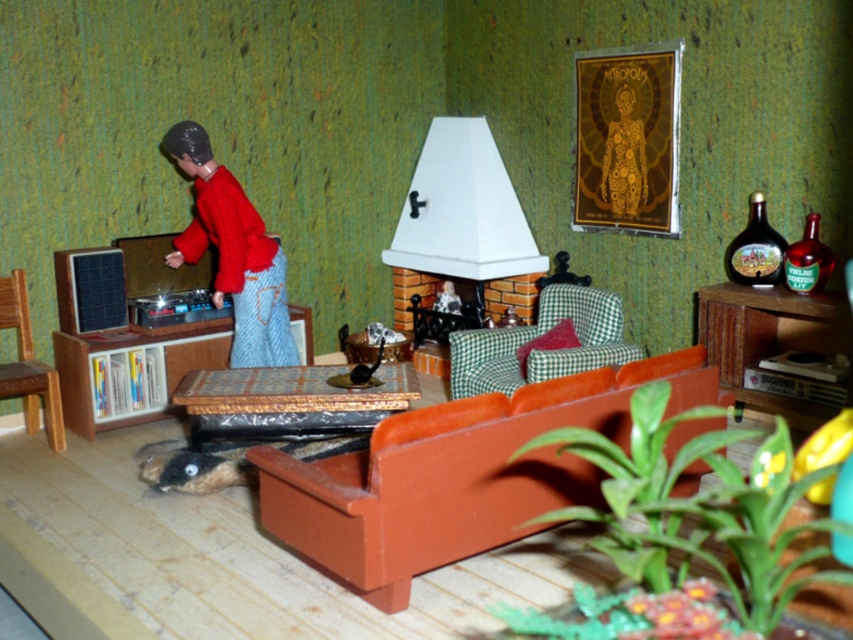
Is point (94, 372) in front of point (511, 371)?

That is True.

Is brown wood cabinet at left in front of green checkered armchair at center?

No, brown wood cabinet at left is further to the viewer.

Is point (84, 426) closer to camera compared to point (491, 337)?

Yes, it is in front of point (491, 337).

Where is `brown wood cabinet at left`? This screenshot has height=640, width=853. brown wood cabinet at left is located at coordinates (131, 372).

Does green checkered armchair at center have a greater width compared to wooden chair at left?

Correct, the width of green checkered armchair at center exceeds that of wooden chair at left.

Can you confirm if green checkered armchair at center is bigger than wooden chair at left?

Indeed, green checkered armchair at center has a larger size compared to wooden chair at left.

This screenshot has width=853, height=640. In order to click on green checkered armchair at center in this screenshot , I will do (541, 349).

Which of these two, wooden coffee table at center or green checkered armchair at center, stands taller?

green checkered armchair at center

Describe the element at coordinates (289, 401) in the screenshot. This screenshot has width=853, height=640. I see `wooden coffee table at center` at that location.

Measure the distance between wooden coffee table at center and camera.

wooden coffee table at center and camera are 3.87 meters apart.

What are the coordinates of `wooden coffee table at center` in the screenshot? It's located at (289, 401).